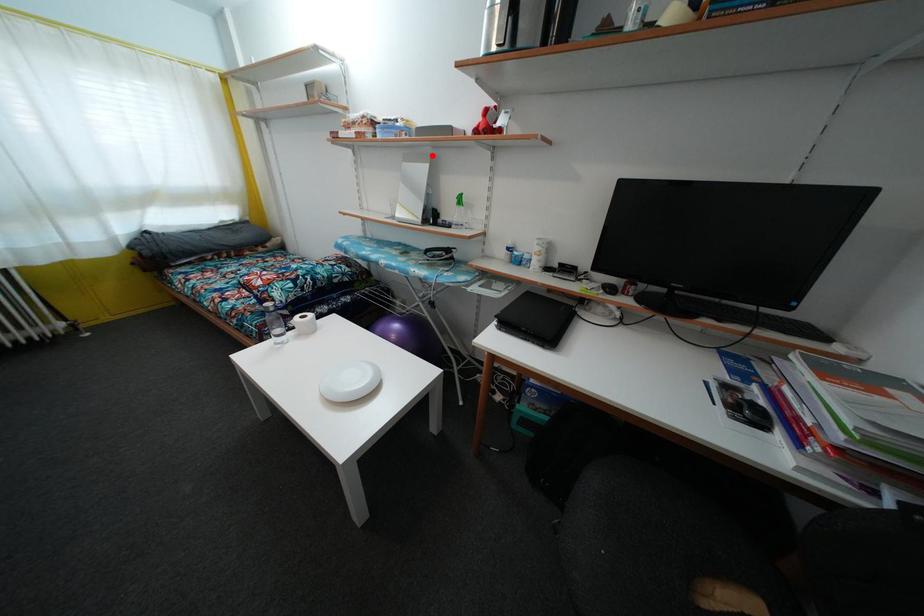
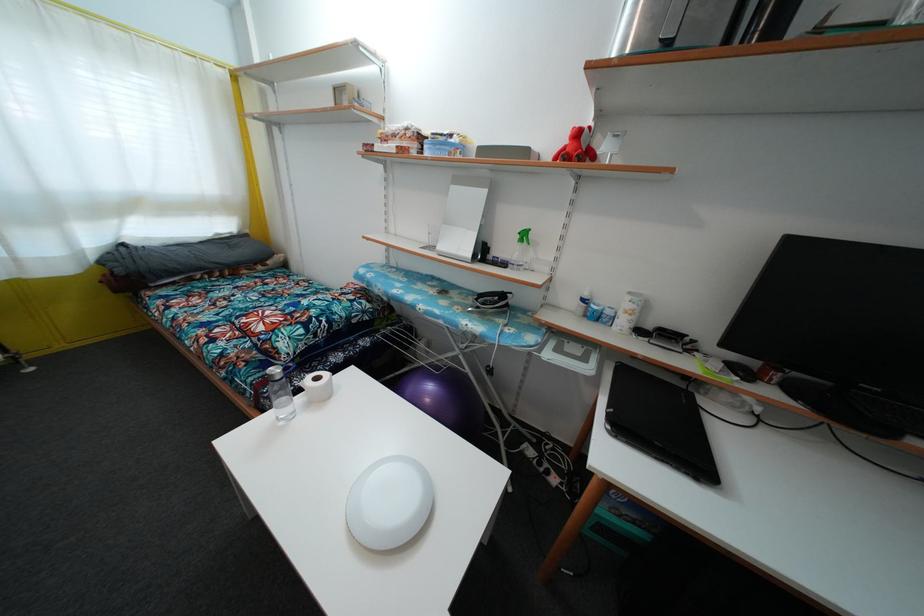
In the second image, find the point that corresponds to the highlighted location in the first image.

(488, 177)